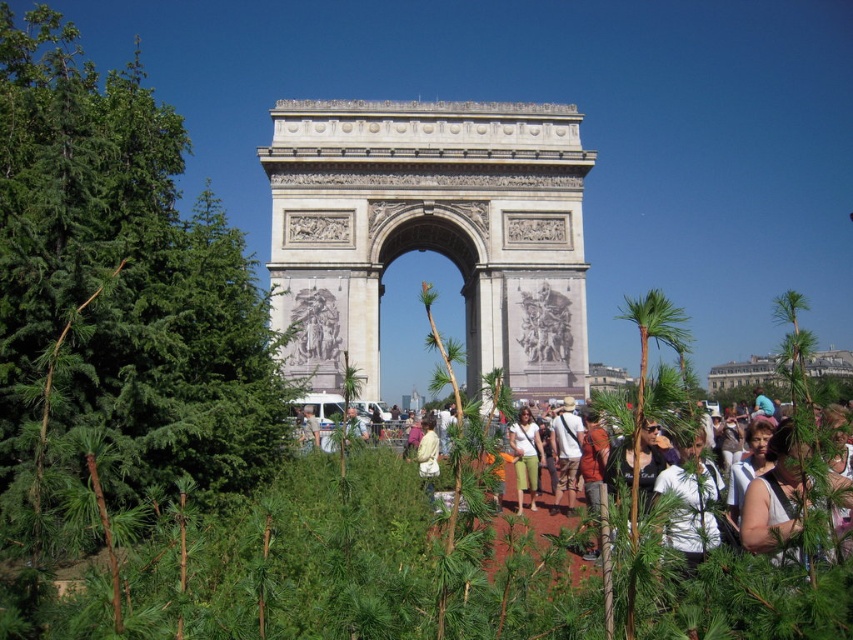
Which is more to the right, stone relief sculpture at center or matte white shirt at center?

stone relief sculpture at center

Is point (564, 312) farther from viewer compared to point (540, 440)?

Yes, point (564, 312) is behind point (540, 440).

The image size is (853, 640). Find the location of `stone relief sculpture at center`. stone relief sculpture at center is located at coordinates (544, 324).

You are a GUI agent. You are given a task and a screenshot of the screen. Output one action in this format:
    pyautogui.click(x=<x>, y=<y>)
    Task: Click on the stone relief sculpture at center
    The height and width of the screenshot is (640, 853).
    Given the screenshot: What is the action you would take?
    pyautogui.click(x=544, y=324)

What do you see at coordinates (566, 451) in the screenshot?
I see `khaki cotton shorts at center` at bounding box center [566, 451].

Is khaki cotton shorts at center taller than light yellow shirt at center?

Indeed, khaki cotton shorts at center has a greater height compared to light yellow shirt at center.

Does point (566, 454) come farther from viewer compared to point (424, 458)?

Yes, it is.

Locate an element on the screen. The image size is (853, 640). khaki cotton shorts at center is located at coordinates (566, 451).

Is stone relief sculpture at center above matte orange shirt at center?

Correct, stone relief sculpture at center is located above matte orange shirt at center.

Locate an element on the screen. stone relief sculpture at center is located at coordinates (544, 324).

Between point (531, 305) and point (585, 483), which one is positioned behind?

The point (531, 305) is behind.

The height and width of the screenshot is (640, 853). Find the location of `stone relief sculpture at center`. stone relief sculpture at center is located at coordinates (544, 324).